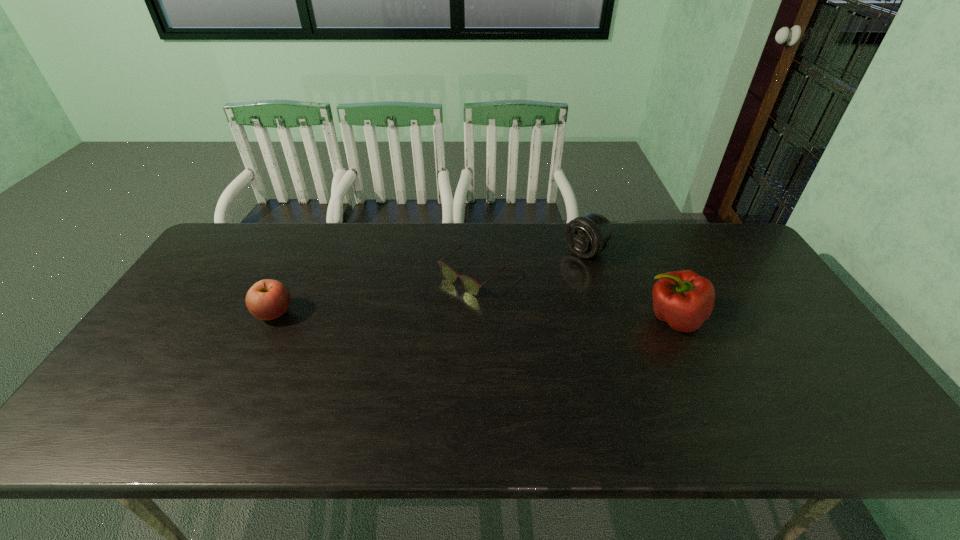
I want to click on blank region between the leftmost object and the bell pepper, so click(x=473, y=316).

Identify the location of blank region between the third tallest object and the second object from right to left. (430, 282).

Where is `unoccupied area between the shortest object and the bell pepper`? unoccupied area between the shortest object and the bell pepper is located at coordinates (574, 297).

Point out which object is positioned as the nearest to the third object from right to left. Please provide its 2D coordinates. Your answer should be formatted as a tuple, i.e. [(x, y)], where the tuple contains the x and y coordinates of a point satisfying the conditions above.

[(587, 235)]

This screenshot has height=540, width=960. I want to click on object that is the third closest to the second object from left to right, so click(268, 299).

At what (x,y) coordinates should I click in order to perform the action: click on free point that satisfies the following two spatial constraints: 1. on the front side of the shortest object; 2. on the right side of the rightmost object. Please return your answer as a coordinate pair (x, y). The height and width of the screenshot is (540, 960). Looking at the image, I should click on (474, 319).

Where is `blank space that satisfies the following two spatial constraints: 1. on the front side of the spectacles; 2. on the left side of the bell pepper`? This screenshot has width=960, height=540. blank space that satisfies the following two spatial constraints: 1. on the front side of the spectacles; 2. on the left side of the bell pepper is located at coordinates (474, 319).